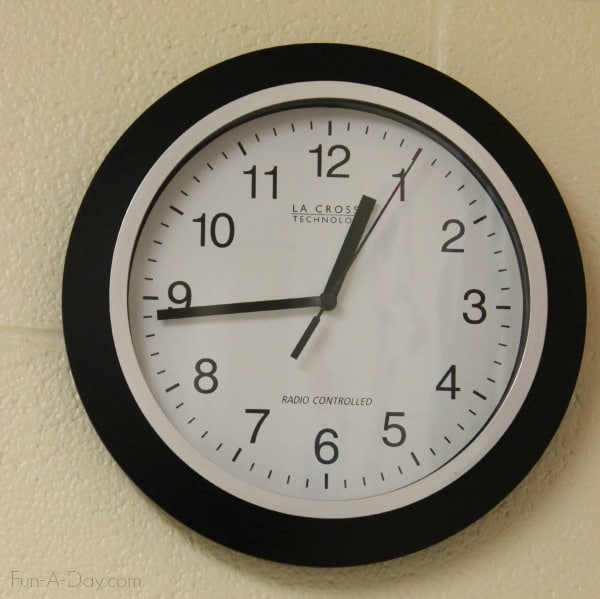
Image resolution: width=600 pixels, height=599 pixels. I want to click on black bezel of the clock, so click(x=93, y=248).